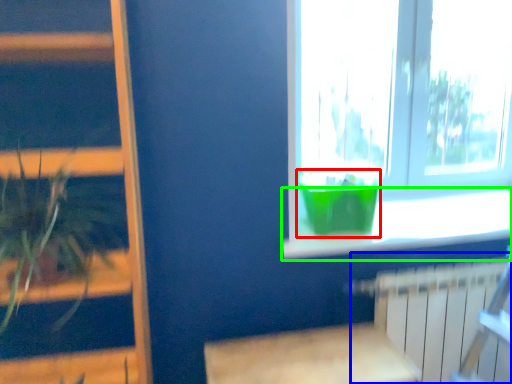
Question: Which object is positioned farthest from glass vase (highlighted by a red box)? Select from radiator (highlighted by a blue box) and window sill (highlighted by a green box).

Choices:
 (A) radiator
 (B) window sill

Answer: (A)